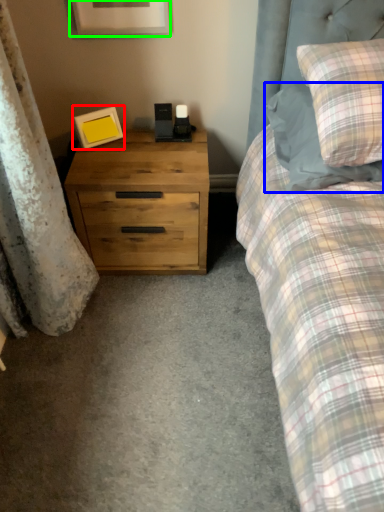
Question: Estimate the real-world distances between objects in this image. Which object is closer to picture frame (highlighted by a red box), pillow (highlighted by a blue box) or picture frame (highlighted by a green box)?

Choices:
 (A) pillow
 (B) picture frame

Answer: (B)